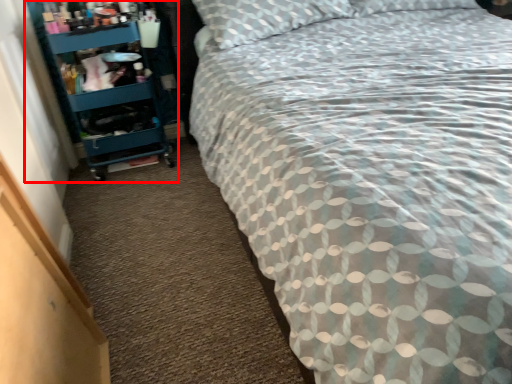
Question: Where is shelf (annotated by the red box) located in relation to bed in the image?

Choices:
 (A) left
 (B) right

Answer: (A)